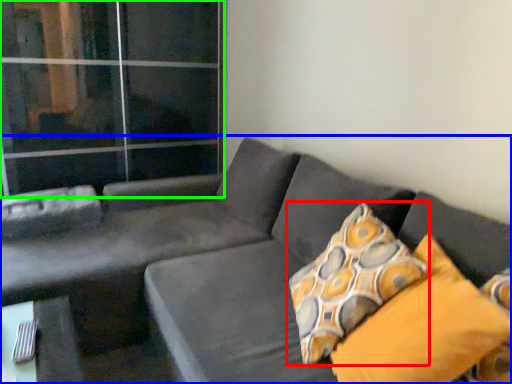
Question: Which object is the closest to the pillow (highlighted by a red box)? Choose among these: studio couch (highlighted by a blue box) or glass door (highlighted by a green box).

Choices:
 (A) studio couch
 (B) glass door

Answer: (A)